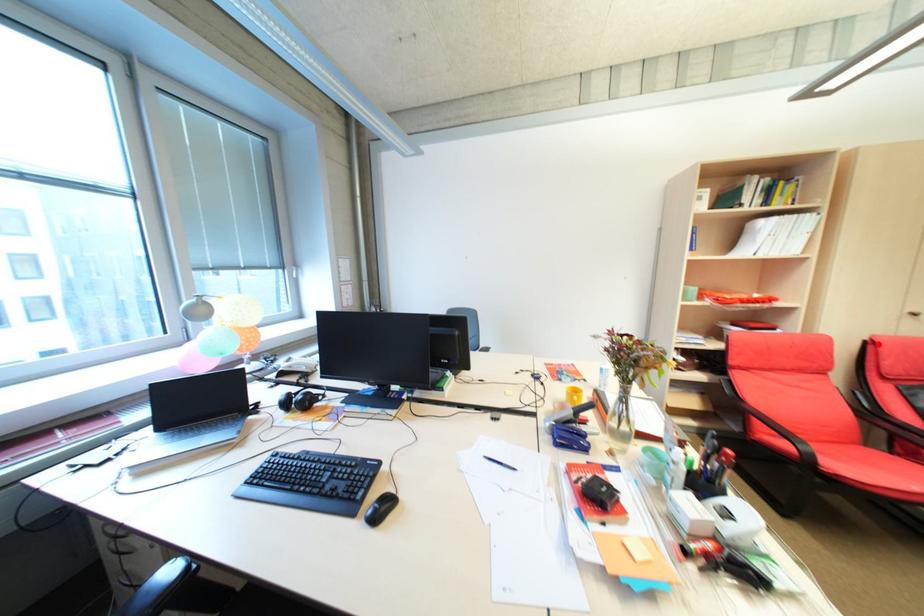
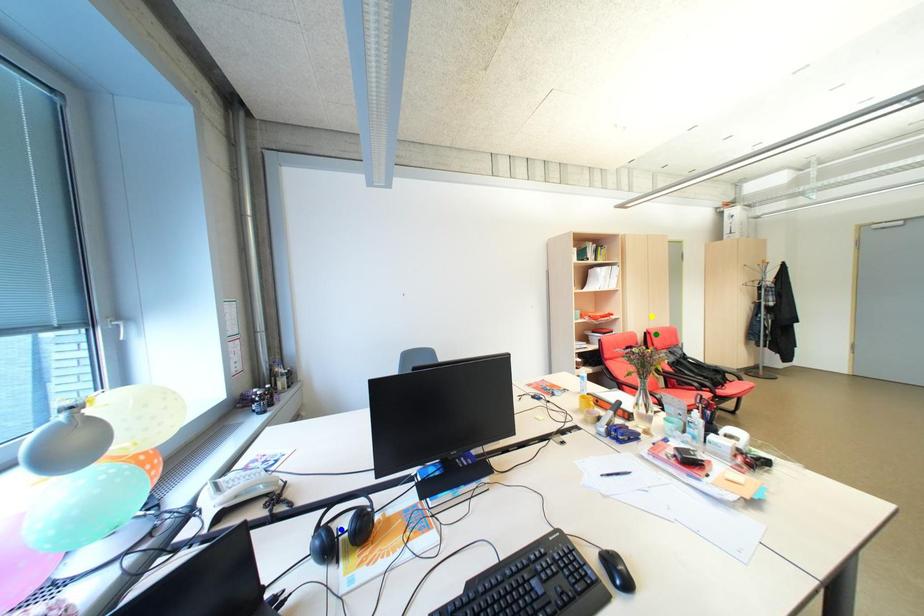
Question: I am providing you with two images of the same scene from different viewpoints. A red point is marked on the first image. You are given multiple points on the second image. Can you choose the point in image 2 that corresponds to the point in image 1?

Choices:
 (A) yellow point
 (B) green point
 (C) blue point

Answer: (B)